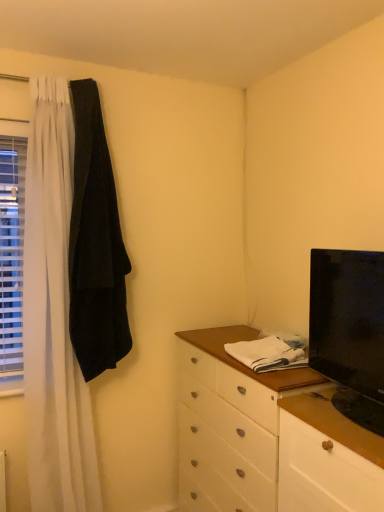
Question: From the image's perspective, is black glossy tv at right under white plastic blinds at left?

Choices:
 (A) yes
 (B) no

Answer: (A)

Question: Considering the relative positions of black glossy tv at right and white plastic blinds at left in the image provided, is black glossy tv at right to the left of white plastic blinds at left from the viewer's perspective?

Choices:
 (A) no
 (B) yes

Answer: (A)

Question: Is black glossy tv at right not near white plastic blinds at left?

Choices:
 (A) no
 (B) yes

Answer: (B)

Question: Does black glossy tv at right have a smaller size compared to white plastic blinds at left?

Choices:
 (A) yes
 (B) no

Answer: (B)

Question: Is black glossy tv at right directly adjacent to white plastic blinds at left?

Choices:
 (A) no
 (B) yes

Answer: (A)

Question: Is white plastic blinds at left inside the boundaries of black velvet robe at left, or outside?

Choices:
 (A) outside
 (B) inside

Answer: (A)

Question: Considering the positions of white plastic blinds at left and black velvet robe at left in the image, is white plastic blinds at left wider or thinner than black velvet robe at left?

Choices:
 (A) wide
 (B) thin

Answer: (B)

Question: Is white plastic blinds at left to the left or to the right of black velvet robe at left in the image?

Choices:
 (A) left
 (B) right

Answer: (A)

Question: Relative to black velvet robe at left, is white plastic blinds at left in front or behind?

Choices:
 (A) front
 (B) behind

Answer: (B)

Question: Visually, is white wood counter top at center positioned to the left or to the right of white plastic blinds at left?

Choices:
 (A) right
 (B) left

Answer: (A)

Question: From the image's perspective, relative to white plastic blinds at left, is white wood counter top at center above or below?

Choices:
 (A) below
 (B) above

Answer: (A)

Question: Relative to white plastic blinds at left, is white wood counter top at center in front or behind?

Choices:
 (A) front
 (B) behind

Answer: (A)

Question: Does point (244, 335) appear closer or farther from the camera than point (8, 395)?

Choices:
 (A) farther
 (B) closer

Answer: (A)

Question: Looking at their shapes, would you say white plastic blinds at left is wider or thinner than black glossy tv at right?

Choices:
 (A) wide
 (B) thin

Answer: (B)

Question: From the image's perspective, is white plastic blinds at left above or below black glossy tv at right?

Choices:
 (A) below
 (B) above

Answer: (B)